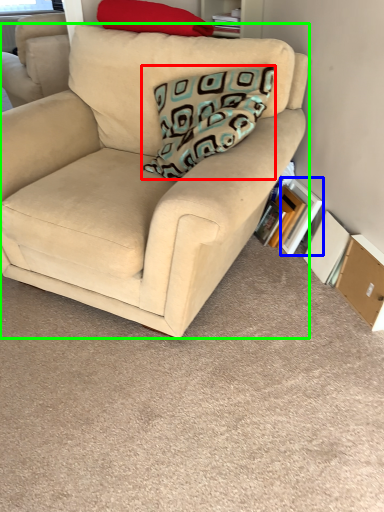
Question: Which is farther away from pillow (highlighted by a red box)? paperback book (highlighted by a blue box) or studio couch (highlighted by a green box)?

Choices:
 (A) paperback book
 (B) studio couch

Answer: (A)